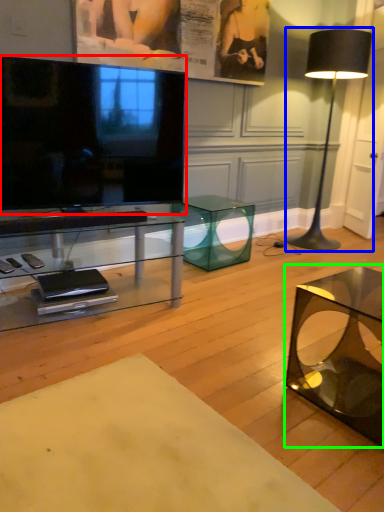
Question: Which is farther away from television (highlighted by a red box)? lamp (highlighted by a blue box) or coffee table (highlighted by a green box)?

Choices:
 (A) lamp
 (B) coffee table

Answer: (A)